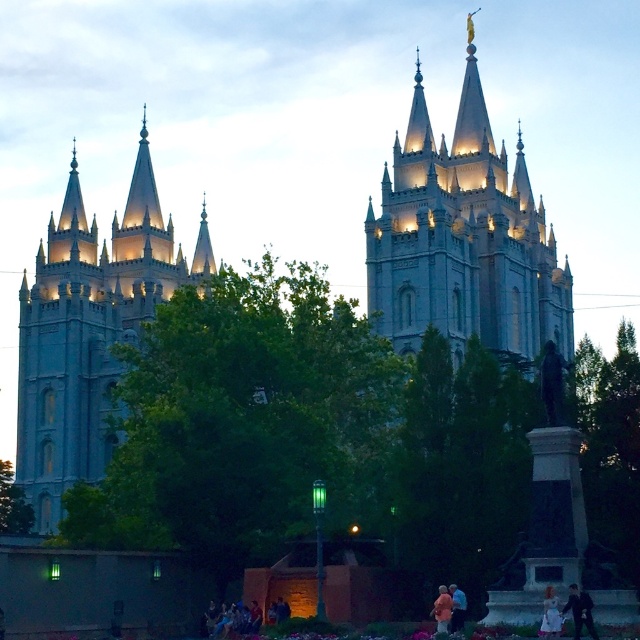
You are a photographer wanting to capture the light gray stone tower at left and the dark blue suit at lower right in the same frame. Which object should you focus on first if you want to ensure both are in focus without moving the camera?

The light gray stone tower at left is wider than the dark blue suit at lower right, so focusing on the wider object first will help keep both in focus.

You are a visitor standing in front of the temple. You notice the light gray stone tower at left and the dark blue suit at lower right. Which object is closer to you?

The dark blue suit at lower right is closer to you because the light gray stone tower at left is positioned over it, indicating it is further away.

You are a visitor at the temple and see the orange fabric coat at lower center and the light blue fabric at lower center. Which fabric is covering the other one?

The orange fabric coat at lower center is positioned over the light blue fabric at lower center, so it is covering it.